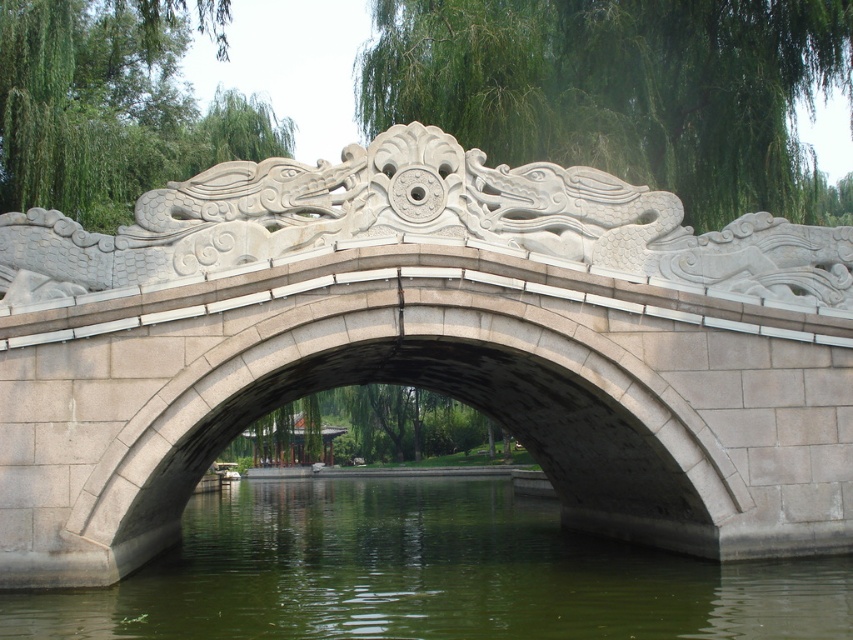
You are standing on the stone bridge and want to reach the point at coordinates point (838, 333). Given that your walking speed is 3 feet per second, how long will it take you to reach that point?

The point at coordinates point (838, 333) is 113.38 feet away from the viewer. At a walking speed of 3 feet per second, it would take approximately 37.8 seconds to reach the point.

You are standing on the stone bridge and want to move from the point at coordinates point (433, 147) to the point at coordinates point (138, 618). Which direction should you walk to get closer to the latter point?

To move from point (433, 147) to point (138, 618), you should walk towards the lower right direction since point (138, 618) is located further away from the viewer compared to point (433, 147).